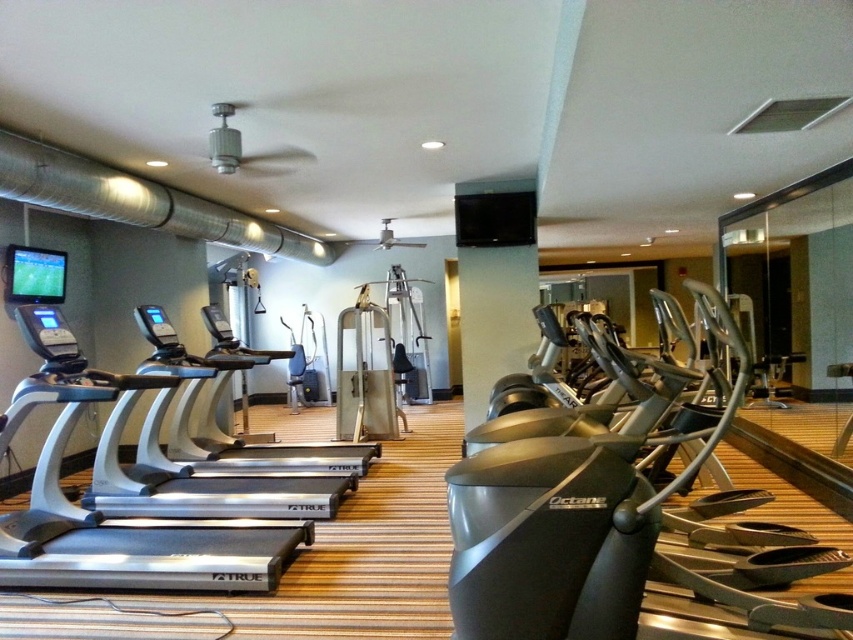
Is black rubberized elliptical at center to the left of silver metallic treadmill at center from the viewer's perspective?

Incorrect, black rubberized elliptical at center is not on the left side of silver metallic treadmill at center.

Can you confirm if black rubberized elliptical at center is positioned above silver metallic treadmill at center?

Yes, black rubberized elliptical at center is above silver metallic treadmill at center.

What do you see at coordinates (622, 525) in the screenshot? I see `black rubberized elliptical at center` at bounding box center [622, 525].

Locate an element on the screen. black rubberized elliptical at center is located at coordinates (622, 525).

Who is higher up, black rubberized elliptical at center or silver metallic treadmill at left?

Positioned higher is black rubberized elliptical at center.

Locate an element on the screen. black rubberized elliptical at center is located at coordinates (622, 525).

Identify the location of black rubberized elliptical at center. The width and height of the screenshot is (853, 640). (622, 525).

Does silver metallic treadmill at left have a greater height compared to silver metallic treadmill at center?

Correct, silver metallic treadmill at left is much taller as silver metallic treadmill at center.

Can you confirm if silver metallic treadmill at left is bigger than silver metallic treadmill at center?

Actually, silver metallic treadmill at left might be smaller than silver metallic treadmill at center.

What do you see at coordinates (100, 512) in the screenshot?
I see `silver metallic treadmill at left` at bounding box center [100, 512].

What are the coordinates of `silver metallic treadmill at left` in the screenshot? It's located at (100, 512).